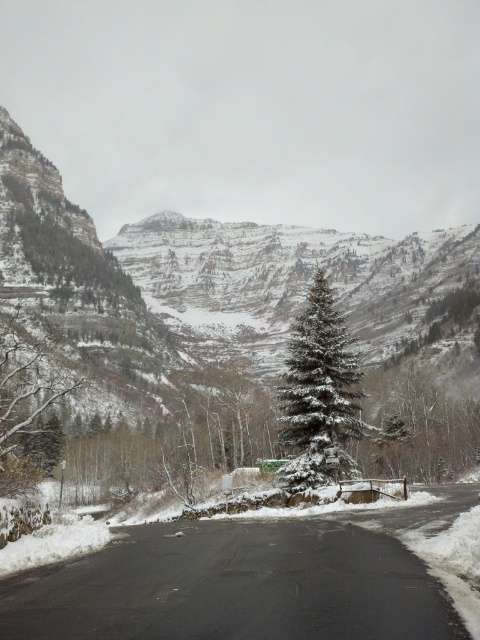
Question: Can you confirm if black asphalt road at center is positioned below snow-covered evergreen at center?

Choices:
 (A) no
 (B) yes

Answer: (B)

Question: Is black asphalt road at center smaller than snow-covered evergreen at center?

Choices:
 (A) no
 (B) yes

Answer: (B)

Question: Among these points, which one is nearest to the camera?

Choices:
 (A) (448, 620)
 (B) (296, 460)

Answer: (A)

Question: Is black asphalt road at center to the right of snow-covered evergreen at center from the viewer's perspective?

Choices:
 (A) yes
 (B) no

Answer: (B)